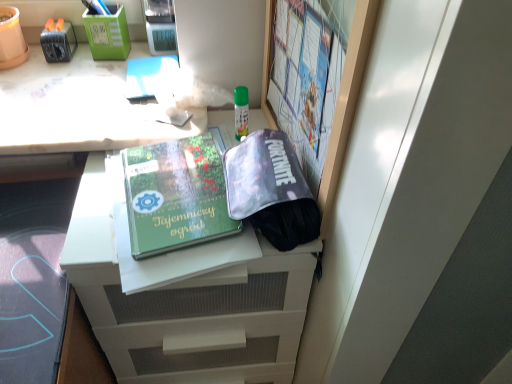
Question: From a real-world perspective, is green plastic pen holder at upper left, the first stationery positioned from the right, positioned above or below matte plastic bulletin board at upper right?

Choices:
 (A) below
 (B) above

Answer: (A)

Question: Is green plastic pen holder at upper left, which is counted as the second stationery, starting from the left, spatially inside matte plastic bulletin board at upper right, or outside of it?

Choices:
 (A) inside
 (B) outside

Answer: (B)

Question: Which object is positioned closest to the green plastic pen holder at upper left, which is counted as the second stationery, starting from the left?

Choices:
 (A) green matte book at center
 (B) matte plastic bulletin board at upper right
 (C) white matte file cabinet at center
 (D) white glossy desk at upper left
 (E) matte black tape dispenser at upper left, which ranks as the 2th stationery in right-to-left order

Answer: (E)

Question: Estimate the real-world distances between objects in this image. Which object is closer to the green plastic pen holder at upper left, the first stationery positioned from the right?

Choices:
 (A) white glossy desk at upper left
 (B) translucent purple pouch at center
 (C) matte plastic bulletin board at upper right
 (D) green matte book at center
 (E) white matte file cabinet at center

Answer: (A)